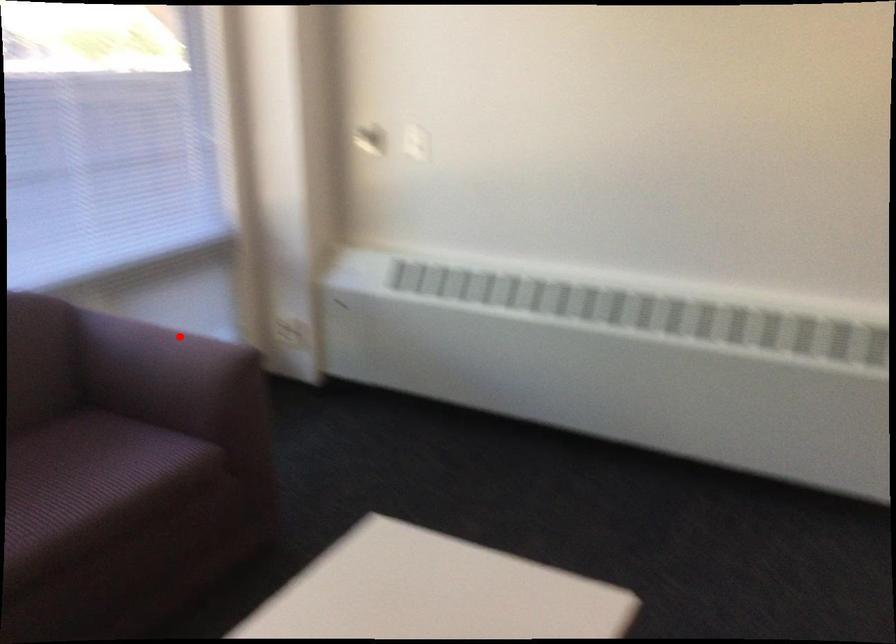
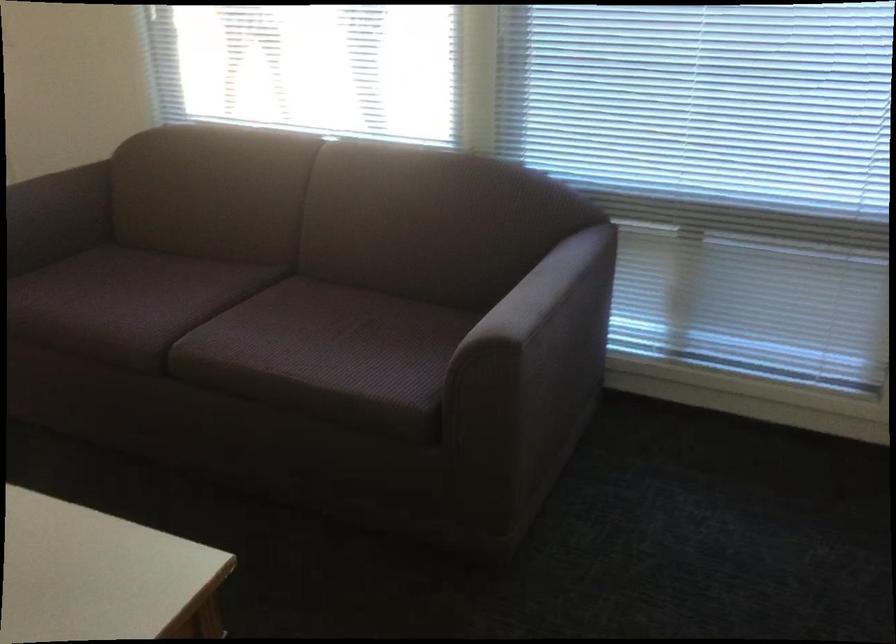
Find the pixel in the second image that matches the highlighted location in the first image.

(545, 294)